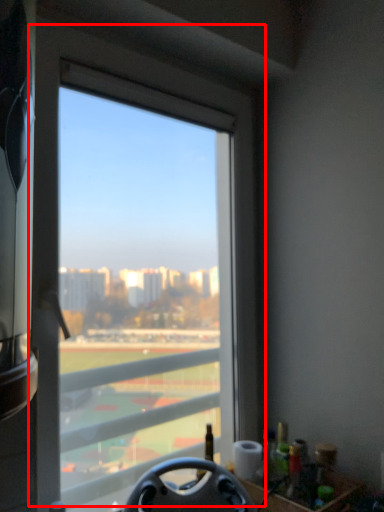
Question: From the image's perspective, what is the correct spatial relationship of window (annotated by the red box) in relation to steering wheel?

Choices:
 (A) below
 (B) above

Answer: (B)